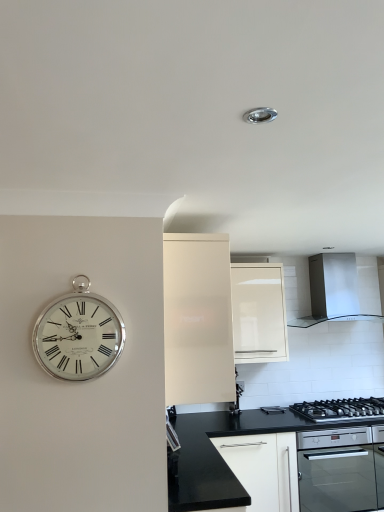
Question: Would you say black granite countertop at lower center is part of stainless steel range hood at upper right's contents?

Choices:
 (A) no
 (B) yes

Answer: (A)

Question: Is stainless steel range hood at upper right thinner than black granite countertop at lower center?

Choices:
 (A) yes
 (B) no

Answer: (B)

Question: Would you consider stainless steel range hood at upper right to be distant from black granite countertop at lower center?

Choices:
 (A) no
 (B) yes

Answer: (B)

Question: Is stainless steel range hood at upper right oriented away from black granite countertop at lower center?

Choices:
 (A) no
 (B) yes

Answer: (A)

Question: Does stainless steel range hood at upper right have a lesser height compared to black granite countertop at lower center?

Choices:
 (A) yes
 (B) no

Answer: (A)

Question: Is the position of stainless steel range hood at upper right less distant than that of black granite countertop at lower center?

Choices:
 (A) no
 (B) yes

Answer: (A)

Question: Can you confirm if black glass oven at lower right is positioned to the right of black stainless steel gas stove at lower right?

Choices:
 (A) no
 (B) yes

Answer: (A)

Question: From the image's perspective, is black glass oven at lower right on black stainless steel gas stove at lower right?

Choices:
 (A) no
 (B) yes

Answer: (A)

Question: Is black stainless steel gas stove at lower right inside black glass oven at lower right?

Choices:
 (A) yes
 (B) no

Answer: (B)

Question: Is black glass oven at lower right aimed at black stainless steel gas stove at lower right?

Choices:
 (A) no
 (B) yes

Answer: (A)

Question: Is black glass oven at lower right not close to black stainless steel gas stove at lower right?

Choices:
 (A) no
 (B) yes

Answer: (A)

Question: Is black glass oven at lower right thinner than black stainless steel gas stove at lower right?

Choices:
 (A) yes
 (B) no

Answer: (B)

Question: Does white glossy cabinet at upper center, placed as the 1th cabinetry when sorted from right to left, come in front of black granite countertop at lower center?

Choices:
 (A) no
 (B) yes

Answer: (A)